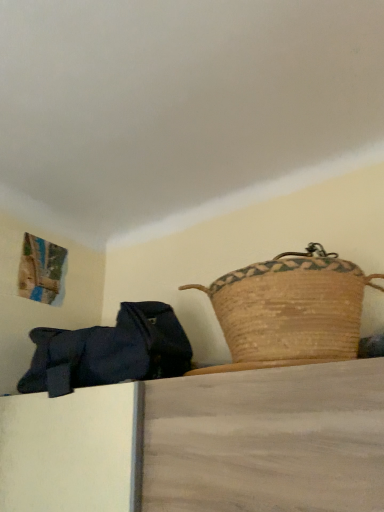
Question: Is brown woven picnic basket at upper right thinner than dark blue fabric bag at left?

Choices:
 (A) yes
 (B) no

Answer: (B)

Question: Could you tell me if brown woven picnic basket at upper right is turned towards dark blue fabric bag at left?

Choices:
 (A) yes
 (B) no

Answer: (B)

Question: From the image's perspective, would you say brown woven picnic basket at upper right is positioned over dark blue fabric bag at left?

Choices:
 (A) no
 (B) yes

Answer: (B)

Question: Is brown woven picnic basket at upper right at the right side of dark blue fabric bag at left?

Choices:
 (A) yes
 (B) no

Answer: (A)

Question: From the image's perspective, is brown woven picnic basket at upper right beneath dark blue fabric bag at left?

Choices:
 (A) no
 (B) yes

Answer: (A)

Question: Can you confirm if brown woven picnic basket at upper right is wider than dark blue fabric bag at left?

Choices:
 (A) yes
 (B) no

Answer: (A)

Question: Is dark blue fabric bag at left bigger than brown woven picnic basket at upper right?

Choices:
 (A) no
 (B) yes

Answer: (B)

Question: Is dark blue fabric bag at left turned away from brown woven picnic basket at upper right?

Choices:
 (A) yes
 (B) no

Answer: (B)

Question: Can you confirm if dark blue fabric bag at left is positioned to the right of brown woven picnic basket at upper right?

Choices:
 (A) no
 (B) yes

Answer: (A)

Question: From a real-world perspective, is dark blue fabric bag at left physically above brown woven picnic basket at upper right?

Choices:
 (A) yes
 (B) no

Answer: (B)

Question: Can you confirm if dark blue fabric bag at left is wider than brown woven picnic basket at upper right?

Choices:
 (A) yes
 (B) no

Answer: (B)

Question: From a real-world perspective, is dark blue fabric bag at left below brown woven picnic basket at upper right?

Choices:
 (A) yes
 (B) no

Answer: (A)

Question: Would you say dark blue fabric bag at left is to the left or to the right of brown woven picnic basket at upper right in the picture?

Choices:
 (A) left
 (B) right

Answer: (A)